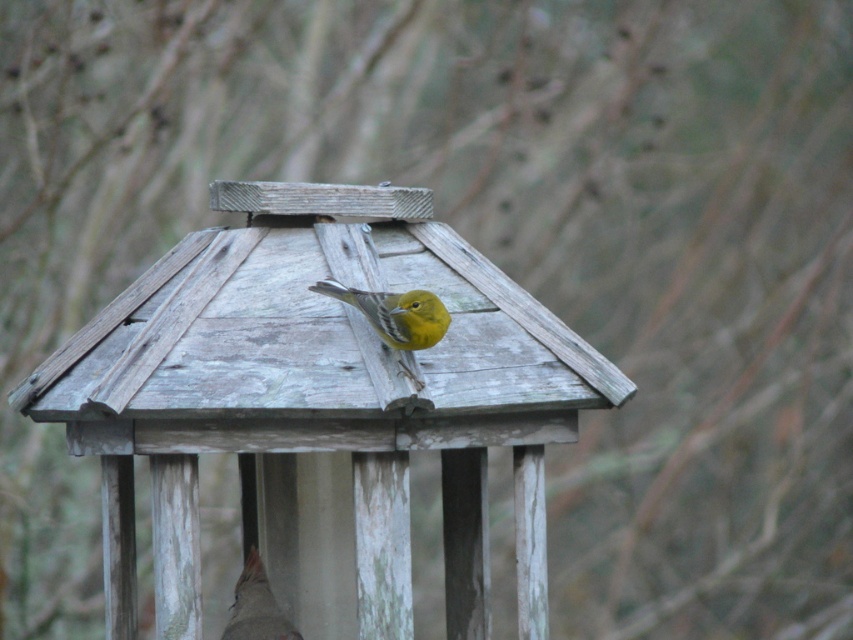
You are a birdwatcher observing the scene. You notice the weathered wood bird feeder at center and the yellow matte bird at center. Which object is positioned to the left of the other?

The weathered wood bird feeder at center is to the left of the yellow matte bird at center.

You are a birdwatcher trying to capture a clear photo of the matte brown bird at center. The weathered wood bird feeder at center is blocking your view. Can you move the feeder to get a better shot?

The weathered wood bird feeder at center is in front of the matte brown bird at center, so moving the feeder would allow you to see the matte brown bird at center clearly.

You are standing in front of the wooden structure and notice two points marked on it. Which point is closer to you, point (x=157, y=563) or point (x=376, y=314)?

Point (x=157, y=563) is in front of point (x=376, y=314), so it is closer to you.